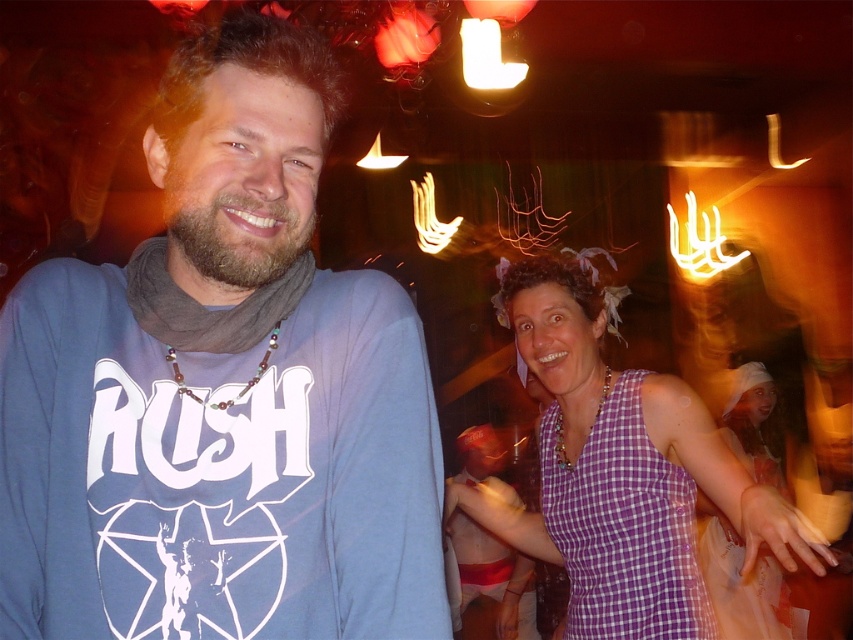
Question: Is blue cotton shirt at left above purple checkered dress at center?

Choices:
 (A) no
 (B) yes

Answer: (B)

Question: Is blue cotton shirt at left to the left of purple checkered dress at center from the viewer's perspective?

Choices:
 (A) yes
 (B) no

Answer: (A)

Question: Among these objects, which one is nearest to the camera?

Choices:
 (A) blue cotton shirt at left
 (B) purple checkered dress at center

Answer: (A)

Question: Does blue cotton shirt at left have a smaller size compared to purple checkered dress at center?

Choices:
 (A) no
 (B) yes

Answer: (B)